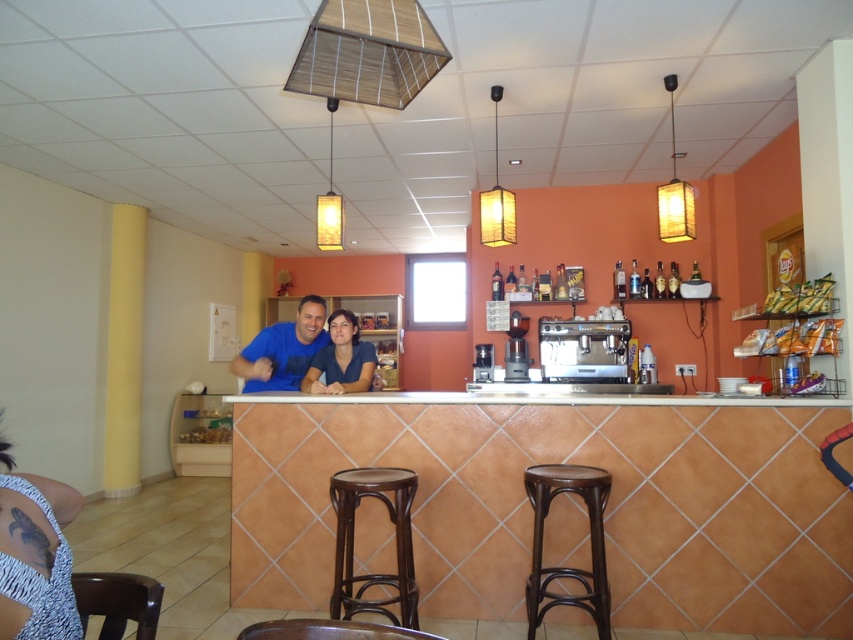
Question: Can you confirm if brown wood stool at center is positioned below brown wood bar stool at lower right?

Choices:
 (A) yes
 (B) no

Answer: (A)

Question: Which point is closer to the camera?

Choices:
 (A) brown wood stool at center
 (B) blue textured dress at lower left
 (C) brown wood bar stool at lower right

Answer: (B)

Question: Among these objects, which one is nearest to the camera?

Choices:
 (A) blue textured dress at lower left
 (B) brown wood stool at center
 (C) blue fabric shirt at center
 (D) brown wood bar stool at lower right

Answer: (A)

Question: Can you confirm if brown wood stool at center is bigger than blue fabric shirt at center?

Choices:
 (A) no
 (B) yes

Answer: (A)

Question: Estimate the real-world distances between objects in this image. Which object is farther from the brown wood bar stool at lower right?

Choices:
 (A) matte blue shirt at center
 (B) blue fabric shirt at center

Answer: (B)

Question: Where is brown wood bar stool at lower right located in relation to blue fabric shirt at center in the image?

Choices:
 (A) left
 (B) right

Answer: (B)